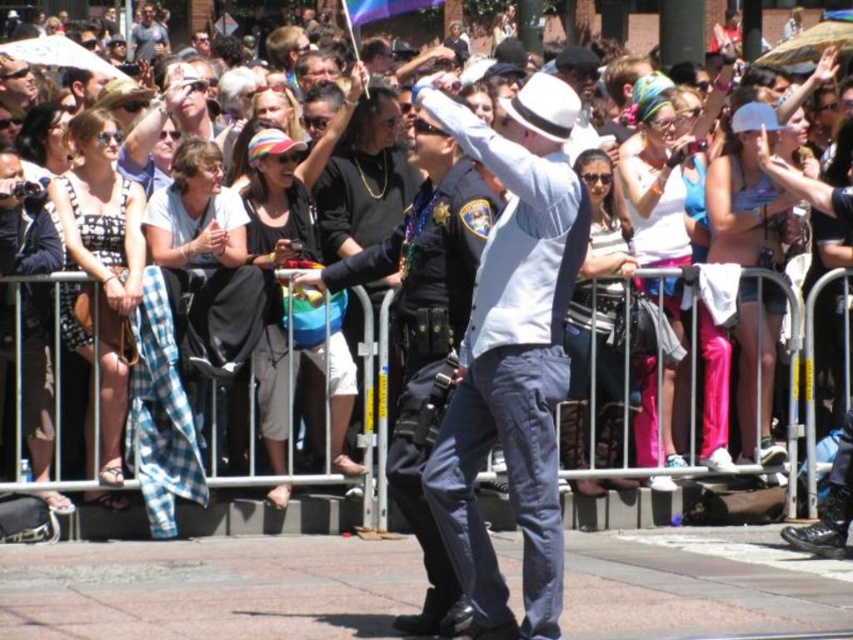
Is white matte fedora at center smaller than matte black shirt at upper center?

Incorrect, white matte fedora at center is not smaller in size than matte black shirt at upper center.

Is point (473, 387) behind point (142, 12)?

No.

The image size is (853, 640). What are the coordinates of `white matte fedora at center` in the screenshot? It's located at (511, 353).

Can you confirm if white matte fedora at center is taller than white matte hat at center?

Yes, white matte fedora at center is taller than white matte hat at center.

Is white matte fedora at center further to the viewer compared to white matte hat at center?

No, it is in front of white matte hat at center.

Who is more distant from viewer, (x=494, y=342) or (x=442, y=576)?

The point (x=442, y=576) is more distant.

Where is `white matte fedora at center`? Image resolution: width=853 pixels, height=640 pixels. white matte fedora at center is located at coordinates (511, 353).

Is metallic silver rail at center closer to the viewer compared to matte black tank top at left?

That is True.

Between point (675, 490) and point (22, 198), which one is positioned behind?

The point (675, 490) is more distant.

What do you see at coordinates (270, 516) in the screenshot? I see `metallic silver rail at center` at bounding box center [270, 516].

The width and height of the screenshot is (853, 640). I want to click on metallic silver rail at center, so [270, 516].